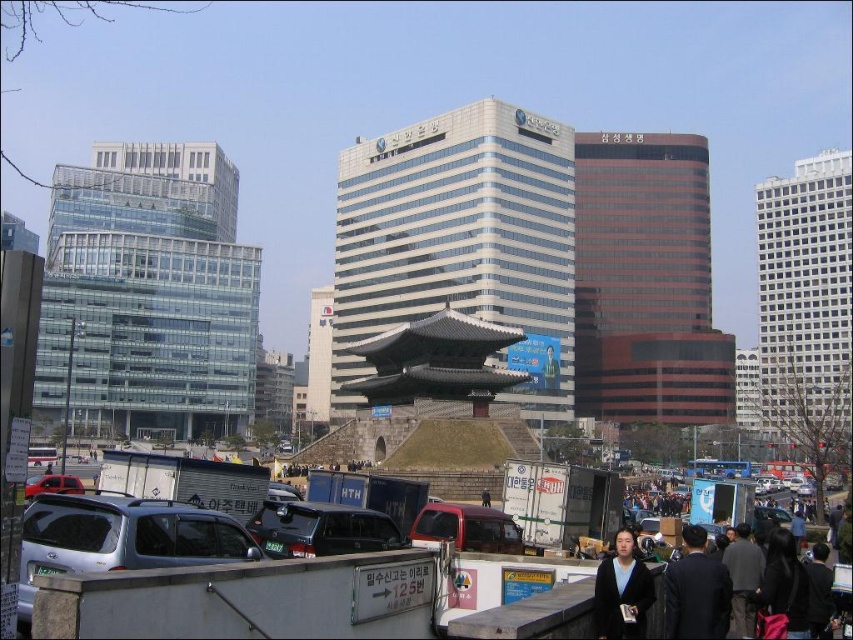
Question: Can you confirm if black matte jacket at lower right is bigger than matte red van at center?

Choices:
 (A) no
 (B) yes

Answer: (A)

Question: Is dark blue suit at center closer to the viewer compared to black matte jacket at lower right?

Choices:
 (A) yes
 (B) no

Answer: (B)

Question: Which object appears farthest from the camera in this image?

Choices:
 (A) matte red van at center
 (B) white glass building at center
 (C) transparent glass building at left
 (D) silver metallic suv at lower left

Answer: (C)

Question: Which point is closer to the camera?

Choices:
 (A) silver metallic suv at lower left
 (B) white glass building at center

Answer: (A)

Question: Does shiny black suv at center come behind matte red car at lower left?

Choices:
 (A) no
 (B) yes

Answer: (B)

Question: Which object is closer to the camera taking this photo?

Choices:
 (A) orange glass tower at center
 (B) transparent glass building at left
 (C) silver metallic suv at lower left
 (D) black wool coat at lower right

Answer: (C)